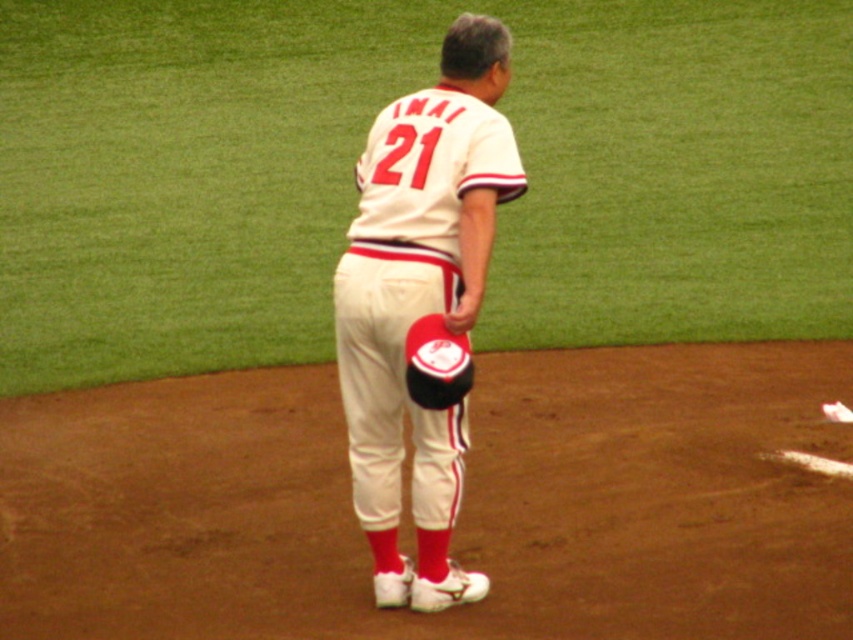
Question: Among these objects, which one is farthest from the camera?

Choices:
 (A) black leather glove at center
 (B) white matte baseball uniform at center

Answer: (B)

Question: Which of the following is the closest to the observer?

Choices:
 (A) (450, 154)
 (B) (425, 394)

Answer: (B)

Question: Does white matte baseball uniform at center have a lesser width compared to black leather glove at center?

Choices:
 (A) no
 (B) yes

Answer: (A)

Question: Does white matte baseball uniform at center appear under black leather glove at center?

Choices:
 (A) yes
 (B) no

Answer: (B)

Question: Can you confirm if white matte baseball uniform at center is bigger than black leather glove at center?

Choices:
 (A) no
 (B) yes

Answer: (B)